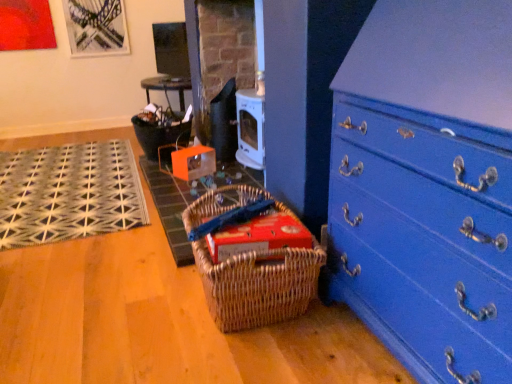
Question: Does blue painted wood chest of drawers at lower right have a lesser height compared to woven mat at center, which is counted as the 2th doormat, starting from the left?

Choices:
 (A) yes
 (B) no

Answer: (B)

Question: Is blue painted wood chest of drawers at lower right smaller than woven mat at center, the first doormat in the right-to-left sequence?

Choices:
 (A) no
 (B) yes

Answer: (A)

Question: Is blue painted wood chest of drawers at lower right looking in the opposite direction of woven mat at center, which is counted as the 2th doormat, starting from the left?

Choices:
 (A) yes
 (B) no

Answer: (B)

Question: Does blue painted wood chest of drawers at lower right have a larger size compared to woven mat at center, the first doormat in the right-to-left sequence?

Choices:
 (A) no
 (B) yes

Answer: (B)

Question: Does blue painted wood chest of drawers at lower right lie in front of woven mat at center, the first doormat in the right-to-left sequence?

Choices:
 (A) yes
 (B) no

Answer: (A)

Question: From a real-world perspective, is matte black basket at center positioned above or below woven brown picnic basket at lower center?

Choices:
 (A) above
 (B) below

Answer: (A)

Question: Is matte black basket at center spatially inside woven brown picnic basket at lower center, or outside of it?

Choices:
 (A) outside
 (B) inside

Answer: (A)

Question: Considering the positions of point (181, 114) and point (206, 264), is point (181, 114) closer or farther from the camera than point (206, 264)?

Choices:
 (A) closer
 (B) farther

Answer: (B)

Question: Visually, is matte black basket at center positioned to the left or to the right of woven brown picnic basket at lower center?

Choices:
 (A) left
 (B) right

Answer: (A)

Question: From their relative heights in the image, would you say woven brown picnic basket at lower center is taller or shorter than blue painted wood chest of drawers at lower right?

Choices:
 (A) short
 (B) tall

Answer: (A)

Question: Is woven brown picnic basket at lower center bigger or smaller than blue painted wood chest of drawers at lower right?

Choices:
 (A) big
 (B) small

Answer: (B)

Question: Is point (231, 200) positioned closer to the camera than point (416, 84)?

Choices:
 (A) closer
 (B) farther

Answer: (B)

Question: Would you say woven brown picnic basket at lower center is to the left or to the right of blue painted wood chest of drawers at lower right in the picture?

Choices:
 (A) right
 (B) left

Answer: (B)

Question: Choose the correct answer: Is blue painted wood chest of drawers at lower right inside matte black basket at center or outside it?

Choices:
 (A) outside
 (B) inside

Answer: (A)

Question: Is blue painted wood chest of drawers at lower right to the left or to the right of matte black basket at center in the image?

Choices:
 (A) left
 (B) right

Answer: (B)